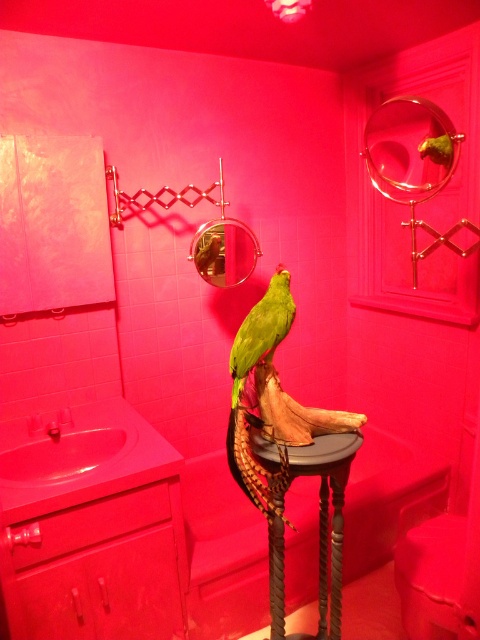
Can you confirm if wooden pedestal at center is positioned to the left of green matte parrot at center?

Incorrect, wooden pedestal at center is not on the left side of green matte parrot at center.

In the scene shown: Who is taller, wooden pedestal at center or green matte parrot at center?

wooden pedestal at center is taller.

Who is more distant from viewer, (352, 444) or (279, 294)?

Positioned behind is point (279, 294).

I want to click on wooden pedestal at center, so click(x=319, y=529).